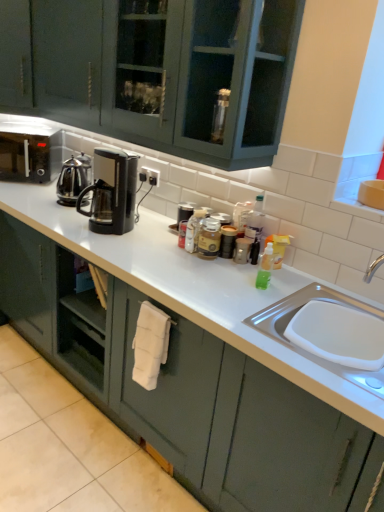
Question: Considering the positions of black plastic coffee maker at center, which ranks as the first kitchen appliance in front-to-back order, and polished stainless steel kettle at left, the first kitchen appliance viewed from the back, in the image, is black plastic coffee maker at center, which ranks as the first kitchen appliance in front-to-back order, wider or thinner than polished stainless steel kettle at left, the first kitchen appliance viewed from the back,?

Choices:
 (A) wide
 (B) thin

Answer: (A)

Question: From a real-world perspective, is black plastic coffee maker at center, which is the 2th kitchen appliance from back to front, positioned above or below polished stainless steel kettle at left, the first kitchen appliance viewed from the back?

Choices:
 (A) above
 (B) below

Answer: (A)

Question: Based on their relative distances, which object is farther from the metallic silver canister at center, which is the first appliance from left to right?

Choices:
 (A) white plastic sink at right
 (B) metallic silver canister at center, which appears as the 2th appliance when viewed from the left
 (C) matte green cabinet at center
 (D) polished stainless steel kettle at left, the 2th kitchen appliance positioned from the right
 (E) black matte microwave at left

Answer: (E)

Question: Considering the real-world distances, which object is farthest from the black matte microwave at left?

Choices:
 (A) metallic silver canister at center, the 2th appliance in the top-to-bottom sequence
 (B) polished stainless steel kettle at left, the 2th kitchen appliance positioned from the right
 (C) white plastic sink at right
 (D) metallic silver canister at center, which is the 2th appliance in front-to-back order
 (E) black plastic coffee maker at center, which is the 2th kitchen appliance from back to front

Answer: (C)